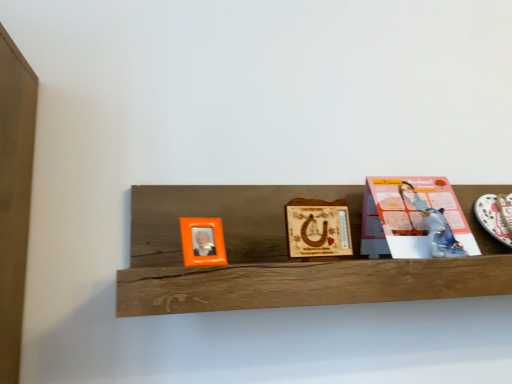
Question: Is orange plastic picture frame at left, which is the second picture frame from right to left, facing away from wooden plaque with horseshoe at center, marked as the second picture frame in a left-to-right arrangement?

Choices:
 (A) yes
 (B) no

Answer: (B)

Question: Is orange plastic picture frame at left, which is the second picture frame from right to left, smaller than wooden plaque with horseshoe at center, marked as the second picture frame in a left-to-right arrangement?

Choices:
 (A) no
 (B) yes

Answer: (B)

Question: Is orange plastic picture frame at left, which is the second picture frame from right to left, oriented towards wooden plaque with horseshoe at center, which is the 1th picture frame from right to left?

Choices:
 (A) yes
 (B) no

Answer: (B)

Question: Can you confirm if orange plastic picture frame at left, which appears as the first picture frame when viewed from the left, is bigger than wooden plaque with horseshoe at center, marked as the second picture frame in a left-to-right arrangement?

Choices:
 (A) no
 (B) yes

Answer: (A)

Question: Could wooden plaque with horseshoe at center, marked as the second picture frame in a left-to-right arrangement, be considered to be inside orange plastic picture frame at left, which is the second picture frame from right to left?

Choices:
 (A) yes
 (B) no

Answer: (B)

Question: Considering the relative positions of orange plastic picture frame at left, which appears as the first picture frame when viewed from the left, and white glossy platter at right in the image provided, is orange plastic picture frame at left, which appears as the first picture frame when viewed from the left, to the left or to the right of white glossy platter at right?

Choices:
 (A) left
 (B) right

Answer: (A)

Question: Considering their positions, is orange plastic picture frame at left, which appears as the first picture frame when viewed from the left, located in front of or behind white glossy platter at right?

Choices:
 (A) front
 (B) behind

Answer: (A)

Question: Is orange plastic picture frame at left, which appears as the first picture frame when viewed from the left, bigger or smaller than white glossy platter at right?

Choices:
 (A) big
 (B) small

Answer: (B)

Question: Is point (206, 231) closer or farther from the camera than point (497, 218)?

Choices:
 (A) closer
 (B) farther

Answer: (A)

Question: Is pink paper at right taller or shorter than orange plastic picture frame at left, which is the second picture frame from right to left?

Choices:
 (A) short
 (B) tall

Answer: (B)

Question: Which is correct: pink paper at right is inside orange plastic picture frame at left, which appears as the first picture frame when viewed from the left, or outside of it?

Choices:
 (A) outside
 (B) inside

Answer: (A)

Question: Looking at their shapes, would you say pink paper at right is wider or thinner than orange plastic picture frame at left, which appears as the first picture frame when viewed from the left?

Choices:
 (A) wide
 (B) thin

Answer: (A)

Question: Considering the positions of pink paper at right and orange plastic picture frame at left, which is the second picture frame from right to left, in the image, is pink paper at right bigger or smaller than orange plastic picture frame at left, which is the second picture frame from right to left,?

Choices:
 (A) big
 (B) small

Answer: (A)

Question: From a real-world perspective, is pink paper at right positioned above or below metallic blue cat at upper right?

Choices:
 (A) above
 (B) below

Answer: (A)

Question: In terms of width, does pink paper at right look wider or thinner when compared to metallic blue cat at upper right?

Choices:
 (A) wide
 (B) thin

Answer: (A)